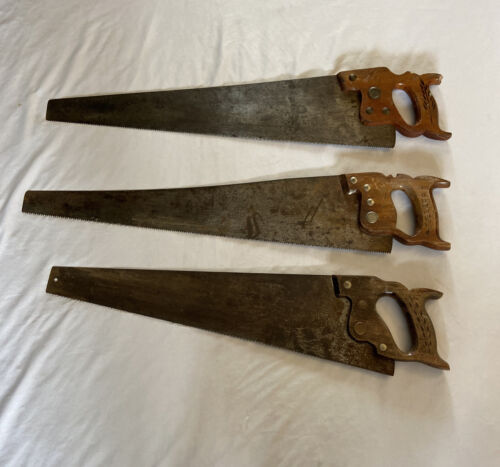
Image resolution: width=500 pixels, height=467 pixels. In order to click on vivid brown handle in this screenshot , I will do `click(430, 113)`.